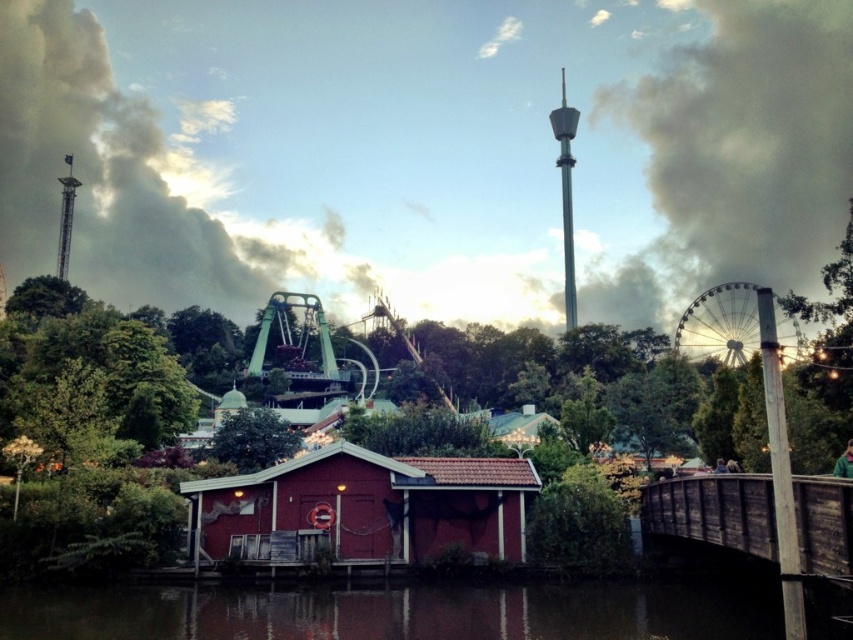
You are standing at the edge of the transparent water at lower center and want to take a photo of the red matte building at center. Since the building is much taller than the water, where should you position yourself to ensure the building is fully visible in the frame?

Since the red matte building at center is much taller than the transparent water at lower center, you should position yourself at a distance from the transparent water at lower center to ensure the building is fully visible in the frame.

You are planning to place a new bench in the amusement park. The bench requires a space that is wider than the transparent water at lower center. Based on the scene, is the red matte building at center a suitable location for placing the bench?

The red matte building at center might be wider than transparent water at lower center, so it could be a suitable location for placing the bench if its width meets the bench requirements.

You are standing at the edge of the amusement park and see the transparent water at lower center and the wooden bridge at lower right. Which object is closer to you?

The transparent water at lower center is closer to you because it is further to the viewer than the wooden bridge at lower right.